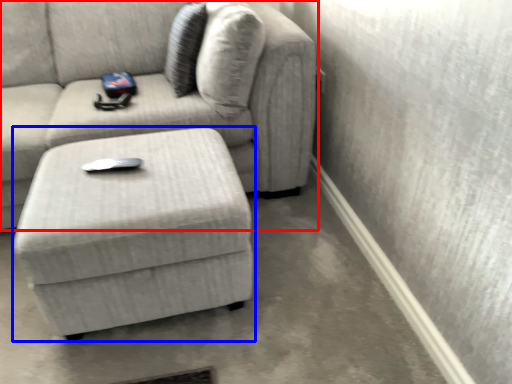
Question: Which point is closer to the camera, studio couch (highlighted by a red box) or table (highlighted by a blue box)?

Choices:
 (A) studio couch
 (B) table

Answer: (B)